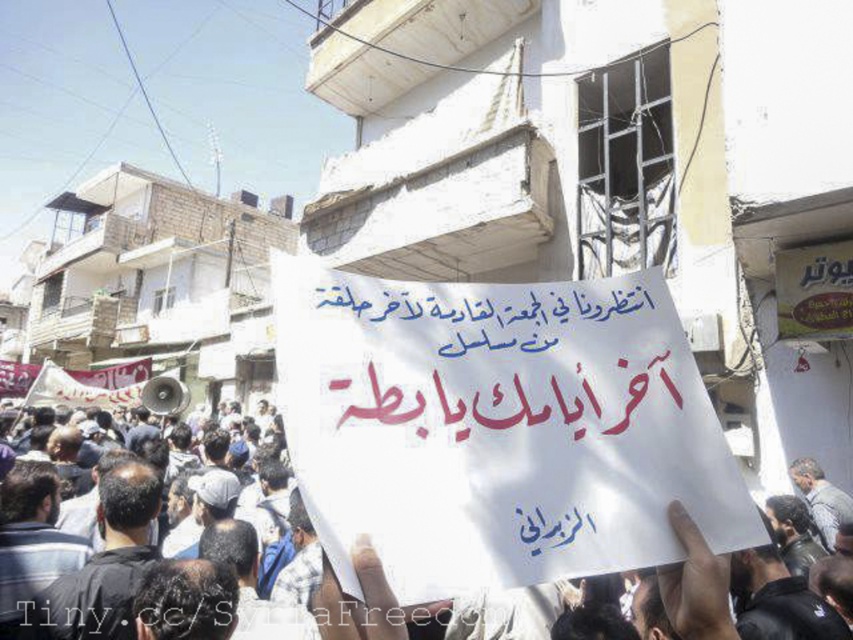
Question: Does white paper sign at center have a lesser width compared to metallic megaphone at center-left?

Choices:
 (A) no
 (B) yes

Answer: (B)

Question: Is the position of white paper sign at center less distant than that of metallic megaphone at center-left?

Choices:
 (A) no
 (B) yes

Answer: (B)

Question: Considering the relative positions of white paper sign at center and metallic megaphone at center-left in the image provided, where is white paper sign at center located with respect to metallic megaphone at center-left?

Choices:
 (A) below
 (B) above

Answer: (B)

Question: Which point is farther from the camera taking this photo?

Choices:
 (A) (672, 609)
 (B) (155, 404)

Answer: (B)